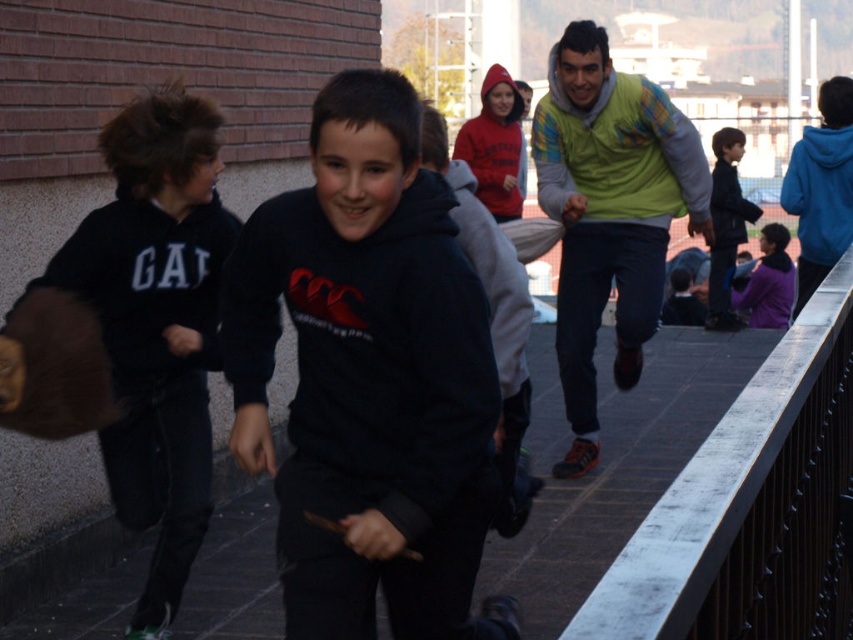
You are a photographer trying to capture a photo of the black hoodie at center and the green fleece sweatshirt at upper right. Which one should you focus on first if you want to ensure both are in the frame without moving the camera?

The black hoodie at center is taller than the green fleece sweatshirt at upper right, so you should focus on the black hoodie at center first to ensure it fits within the frame before adjusting for the smaller green fleece sweatshirt at upper right.

You are standing on the black asphalt pavement at center and want to reach the red fleece hoodie at center. In which direction should you move?

You should move to the right because the black asphalt pavement at center is to the left of the red fleece hoodie at center.

You are a photographer standing at the camera position. You want to take a photo focusing on the point closer to you. Which point should you choose between point (448,205) and point (614,186)?

Point (448,205) is closer to the camera than point (614,186), so you should choose point (448,205) to focus on.